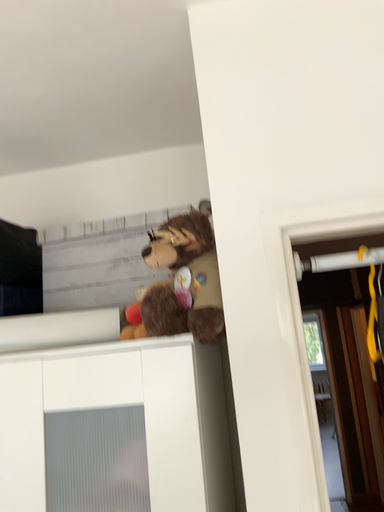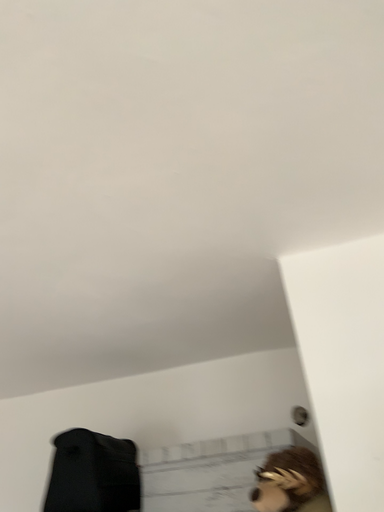
Question: Which way did the camera rotate in the video?

Choices:
 (A) rotated upward
 (B) rotated downward

Answer: (A)